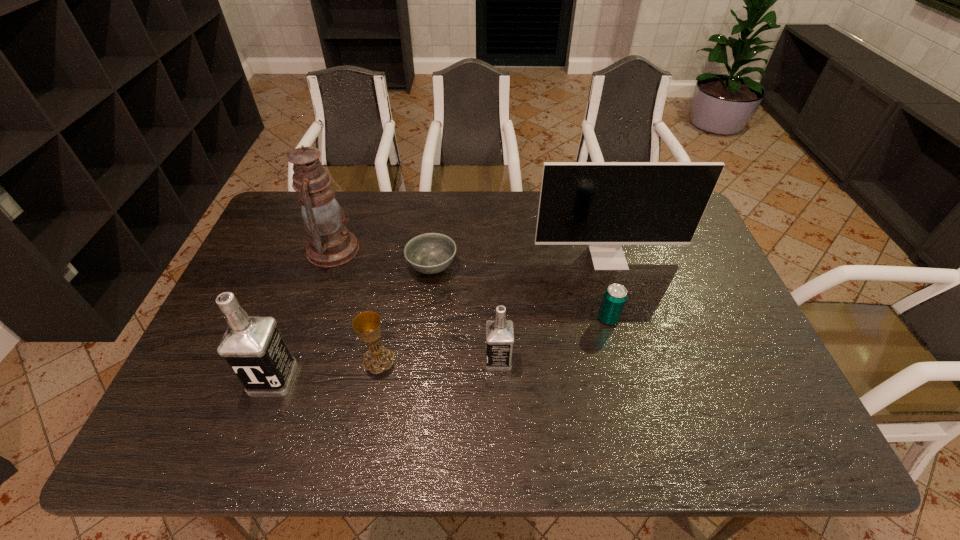
The width and height of the screenshot is (960, 540). Identify the location of object that is at the right edge. (605, 205).

Identify the location of object that is at the near left corner. The image size is (960, 540). [x=253, y=347].

In the image, there is a desktop. Identify the location of vacant space at the far edge. click(453, 233).

This screenshot has width=960, height=540. What are the coordinates of `free space at the near edge of the desktop` in the screenshot? It's located at (483, 406).

At what (x,y) coordinates should I click in order to perform the action: click on vacant space at the left edge of the desktop. Please return your answer as a coordinate pair (x, y). This screenshot has height=540, width=960. Looking at the image, I should click on (276, 298).

In the image, there is a desktop. Identify the location of vacant space at the right edge. The height and width of the screenshot is (540, 960). (659, 249).

At what (x,y) coordinates should I click in order to perform the action: click on free point between the chalice and the monitor. Please return your answer as a coordinate pair (x, y). The height and width of the screenshot is (540, 960). Looking at the image, I should click on (493, 309).

The height and width of the screenshot is (540, 960). Identify the location of vacant space in between the monitor and the left vodka. (441, 319).

I want to click on free point between the fourth tallest object and the oil lamp, so click(416, 305).

The width and height of the screenshot is (960, 540). Identify the location of vacant area that lies between the monitor and the fifth tallest object. (493, 309).